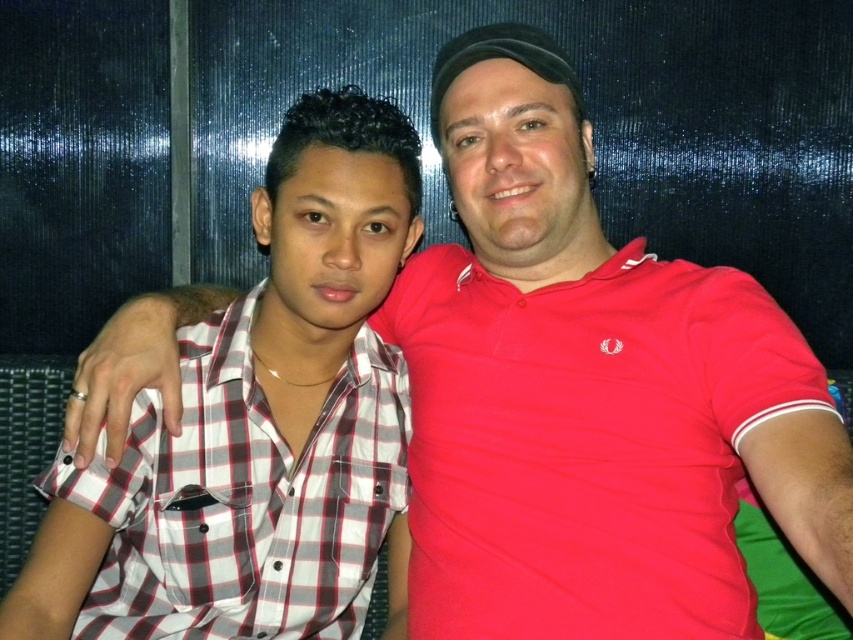
Question: Is red cotton polo shirt at right to the left of white checkered shirt at left from the viewer's perspective?

Choices:
 (A) no
 (B) yes

Answer: (A)

Question: Among these points, which one is nearest to the camera?

Choices:
 (A) (315, 625)
 (B) (560, 580)

Answer: (B)

Question: Does red cotton polo shirt at right have a larger size compared to white checkered shirt at left?

Choices:
 (A) no
 (B) yes

Answer: (B)

Question: Which point is closer to the camera taking this photo?

Choices:
 (A) (579, 516)
 (B) (364, 316)

Answer: (A)

Question: Where is red cotton polo shirt at right located in relation to white checkered shirt at left in the image?

Choices:
 (A) right
 (B) left

Answer: (A)

Question: Among these points, which one is farthest from the camera?

Choices:
 (A) (171, 552)
 (B) (421, 481)

Answer: (B)